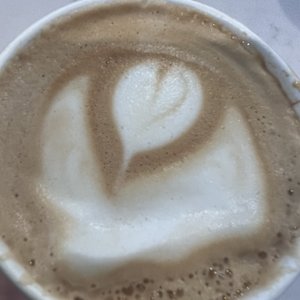
Where is `foam`? The image size is (300, 300). foam is located at coordinates (158, 208).